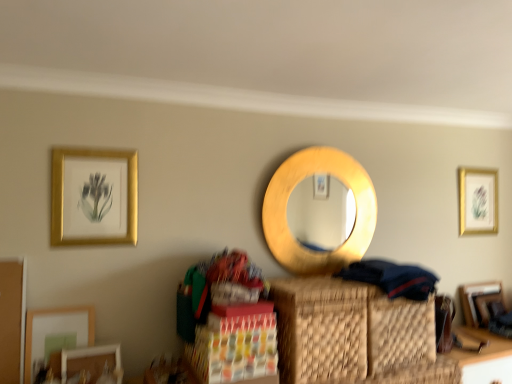
Question: From the image's perspective, is wooden table at lower right positioned above or below dark blue fabric at lower right?

Choices:
 (A) above
 (B) below

Answer: (B)

Question: Is wooden table at lower right bigger or smaller than dark blue fabric at lower right?

Choices:
 (A) big
 (B) small

Answer: (A)

Question: Estimate the real-world distances between objects in this image. Which object is closer to the wooden table at lower right?

Choices:
 (A) matte white picture frame at lower left, arranged as the first picture frame when viewed from the front
 (B) dark blue fabric at lower right
 (C) gold/golden frame at upper right, arranged as the 1th picture frame when viewed from the back
 (D) gold wooden mirror at center
 (E) gold/golden frame at upper left, the 4th picture frame in the right-to-left sequence

Answer: (B)

Question: Estimate the real-world distances between objects in this image. Which object is farther from the gold/golden frame at upper left, the third picture frame from the front?

Choices:
 (A) matte white picture frame at lower left, arranged as the first picture frame when viewed from the front
 (B) dark blue fabric at lower right
 (C) wooden table at lower right
 (D) gold/golden frame at upper right, marked as the 5th picture frame in a left-to-right arrangement
 (E) wooden picture frame at lower right, which ranks as the second picture frame in right-to-left order

Answer: (E)